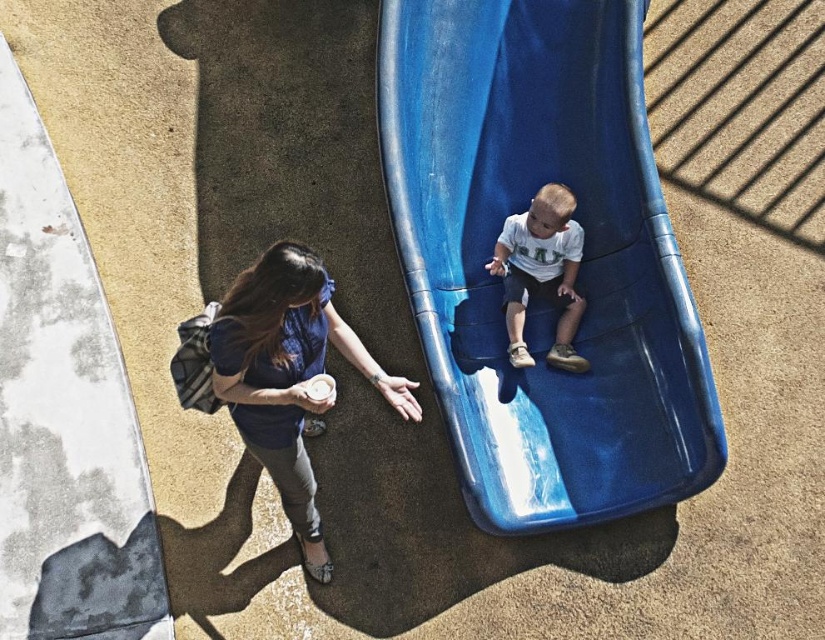
You are a photographer trying to capture a photo of the blue plastic slide at center and the white matte shirt at center for a catalog. Which object should you zoom in on to ensure both fit in the frame without cropping?

The blue plastic slide at center is wider than the white matte shirt at center, so you should zoom in on the blue plastic slide at center to ensure both fit in the frame without cropping.

You are a photographer trying to capture a photo of the blue plastic slide at center and the blue fabric shirt at lower left. Which object should you focus on first if you want to include both in the frame without moving the camera?

The blue plastic slide at center is much taller than the blue fabric shirt at lower left, so focusing on the slide first would ensure it fits within the frame while still capturing the shirt in the background.

You are a photographer trying to capture a candid shot of the white matte shirt at center without including the blue plastic slide at center in the frame. Is this possible given their positions?

The blue plastic slide at center is located above the white matte shirt at center, so it would block the direct view. To capture the white matte shirt at center without the blue plastic slide at center, you would need to adjust the angle or position to frame around the slide.